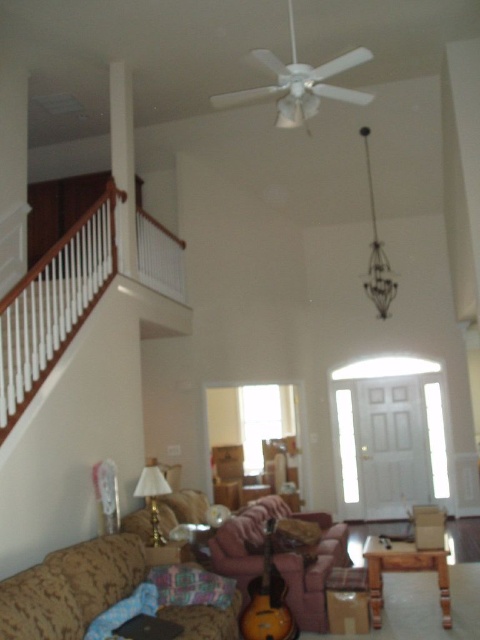
Does wooden coffee table at lower center come in front of sunburst wood guitar at lower center?

No, it is behind sunburst wood guitar at lower center.

Based on the photo, does wooden coffee table at lower center appear on the left side of sunburst wood guitar at lower center?

Incorrect, wooden coffee table at lower center is not on the left side of sunburst wood guitar at lower center.

At what (x,y) coordinates should I click in order to perform the action: click on wooden coffee table at lower center. Please return your answer as a coordinate pair (x, y). The width and height of the screenshot is (480, 640). Looking at the image, I should click on (405, 572).

In order to click on wooden coffee table at lower center in this screenshot , I will do `click(405, 572)`.

Between brown textured couch at lower left and sunburst wood guitar at lower center, which one is positioned lower?

sunburst wood guitar at lower center

Is brown textured couch at lower left further to camera compared to sunburst wood guitar at lower center?

No, it is not.

Identify the location of brown textured couch at lower left. This screenshot has height=640, width=480. (71, 588).

Is brown textured couch at lower left to the right of velvet pink pillow at lower center from the viewer's perspective?

In fact, brown textured couch at lower left is to the left of velvet pink pillow at lower center.

Can you confirm if brown textured couch at lower left is shorter than velvet pink pillow at lower center?

No.

The image size is (480, 640). In order to click on brown textured couch at lower left in this screenshot , I will do `click(71, 588)`.

Find the location of a particular element. brown textured couch at lower left is located at coordinates (71, 588).